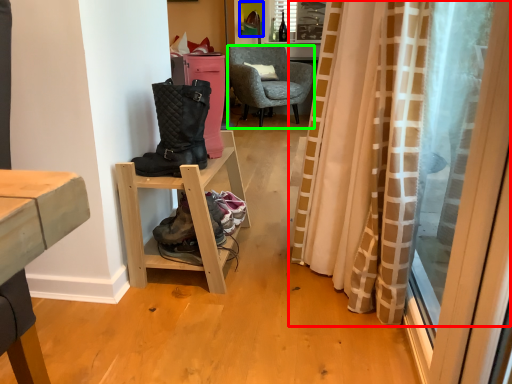
Question: Estimate the real-world distances between objects in this image. Which object is farther from curtain (highlighted by a red box), picture frame (highlighted by a blue box) or chair (highlighted by a green box)?

Choices:
 (A) picture frame
 (B) chair

Answer: (A)